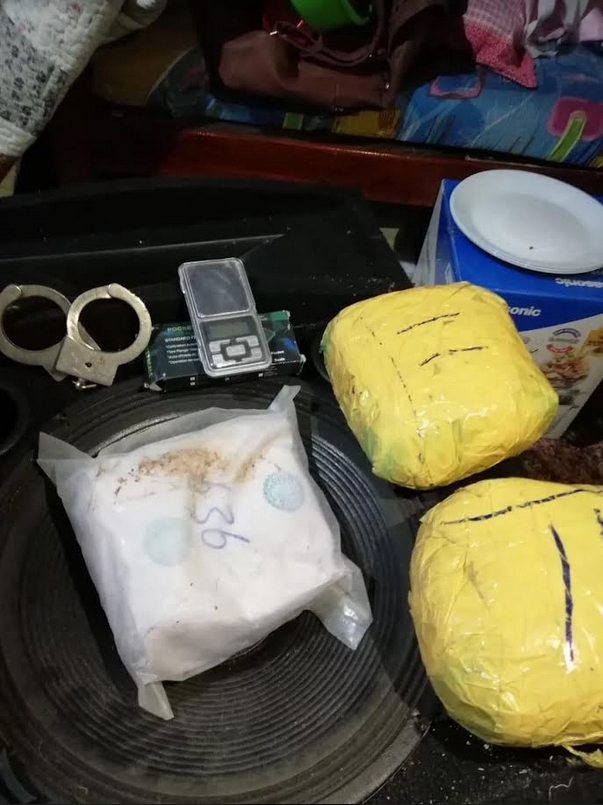
Locate an element on the screen. The image size is (603, 805). speaker is located at coordinates (248, 741).